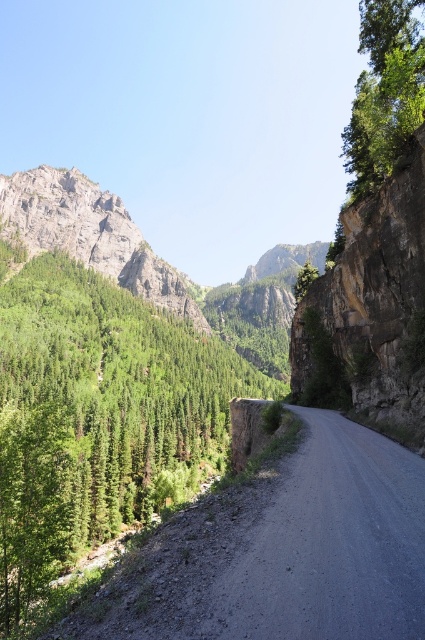
Consider the image. Does green matte tree at left appear on the right side of gray gravel road at center?

No, green matte tree at left is not to the right of gray gravel road at center.

This screenshot has height=640, width=425. Find the location of `green matte tree at left`. green matte tree at left is located at coordinates (98, 417).

Who is more forward, (155,440) or (402,560)?

Point (402,560)

I want to click on green matte tree at left, so click(98, 417).

Who is positioned more to the left, green matte tree at left or rugged granite mountain at upper left?

rugged granite mountain at upper left is more to the left.

Can you confirm if green matte tree at left is smaller than rugged granite mountain at upper left?

Actually, green matte tree at left might be larger than rugged granite mountain at upper left.

Is point (93, 388) in front of point (45, 227)?

That is True.

You are a GUI agent. You are given a task and a screenshot of the screen. Output one action in this format:
    pyautogui.click(x=<x>, y=<y>)
    Task: Click on the green matte tree at left
    
    Given the screenshot: What is the action you would take?
    pyautogui.click(x=98, y=417)

Does point (280, 588) lie in front of point (62, 224)?

Yes, it is.

Is gray gravel road at center thinner than rugged granite mountain at upper left?

Correct, gray gravel road at center's width is less than rugged granite mountain at upper left's.

Where is `gray gravel road at center`? gray gravel road at center is located at coordinates (329, 545).